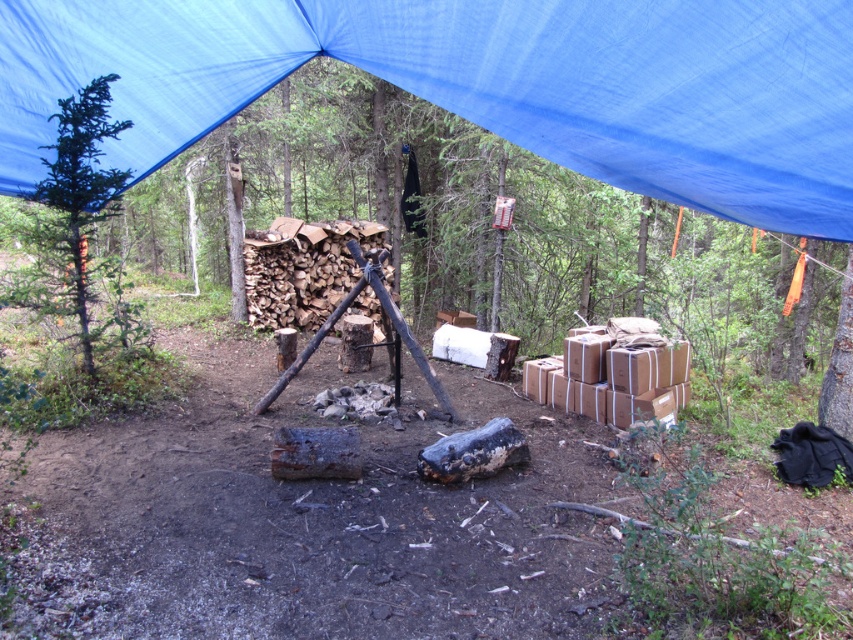
You are setting up a campsite and want to ensure your supplies are protected from rain. Given the blue fabric canopy at upper center and the green matte tree at left, which object should you place your supplies under to keep them dry?

You should place your supplies under the blue fabric canopy at upper center because it is positioned over the green matte tree at left, providing shelter from rain.

You are a hiker who needs to determine if the blue fabric canopy at upper center can provide shade for your tent, which is placed near the green matte tree at left. Based on their sizes, will the canopy be taller than the tree?

The blue fabric canopy at upper center is shorter than the green matte tree at left, so it will not be taller than the tree and may not provide sufficient shade for your tent.